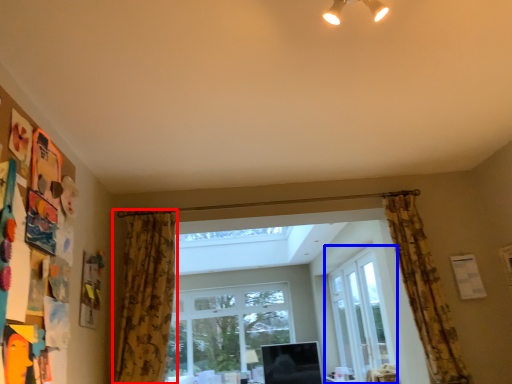
Question: Among these objects, which one is nearest to the camera, curtain (highlighted by a red box) or window (highlighted by a blue box)?

Choices:
 (A) curtain
 (B) window

Answer: (A)